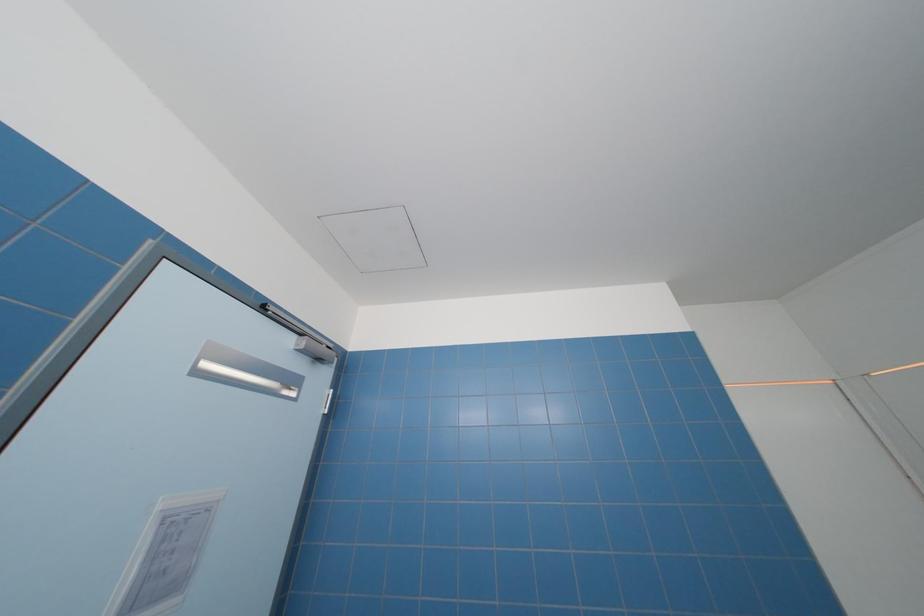
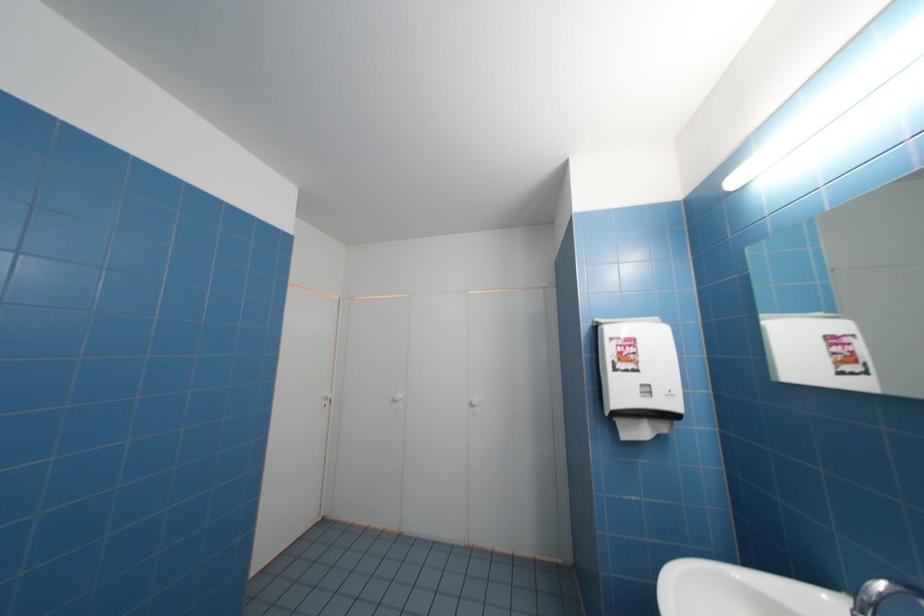
Question: The camera is either moving clockwise (left) or counter-clockwise (right) around the object. The first image is from the beginning of the video and the second image is from the end. Is the camera moving left or right when shooting the video?

Choices:
 (A) Left
 (B) Right

Answer: (A)